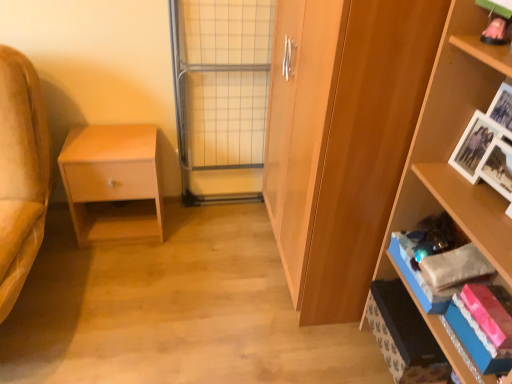
In order to click on free space in front of matte wood nightstand at left in this screenshot , I will do `click(106, 275)`.